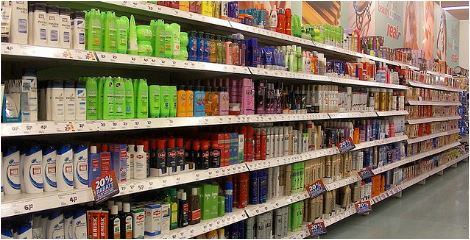
Image resolution: width=470 pixels, height=240 pixels. I want to click on bottom left corner tile floor, so click(466, 235), click(463, 171), click(362, 227), click(424, 213).